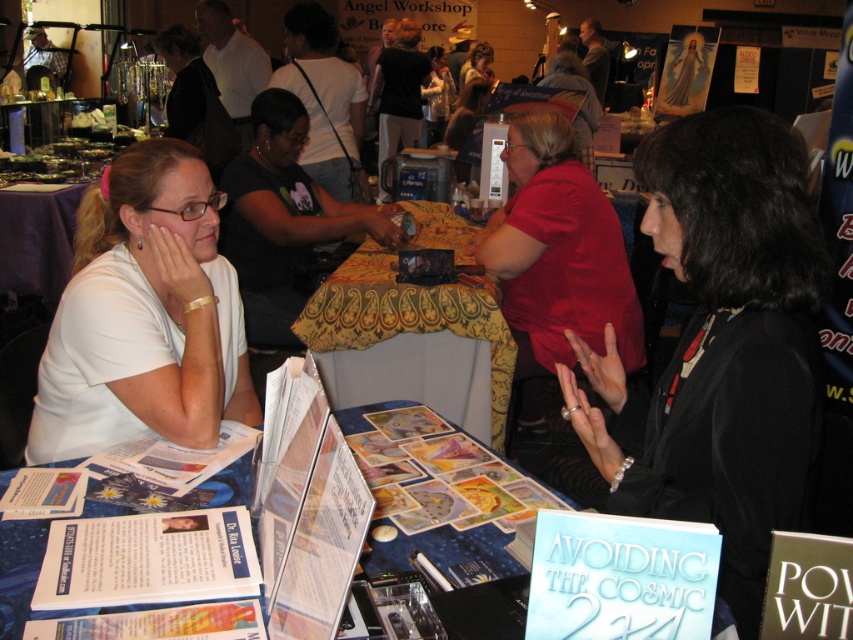
Question: Does white matte shirt at left have a larger size compared to blue fabric table at center?

Choices:
 (A) no
 (B) yes

Answer: (A)

Question: Does black leather jacket at right have a smaller size compared to blue fabric table at center?

Choices:
 (A) no
 (B) yes

Answer: (A)

Question: Which object is closer to the camera taking this photo?

Choices:
 (A) black leather jacket at right
 (B) black matte shirt at center

Answer: (A)

Question: Which point is farther to the camera?

Choices:
 (A) (729, 134)
 (B) (618, 284)
 (C) (364, 266)
 (D) (434, 544)

Answer: (C)

Question: Which of the following is the farthest from the observer?

Choices:
 (A) (515, 369)
 (B) (355, 278)
 (C) (105, 368)
 (D) (244, 198)

Answer: (D)

Question: Is black matte shirt at center further to the viewer compared to blue fabric table at center?

Choices:
 (A) yes
 (B) no

Answer: (A)